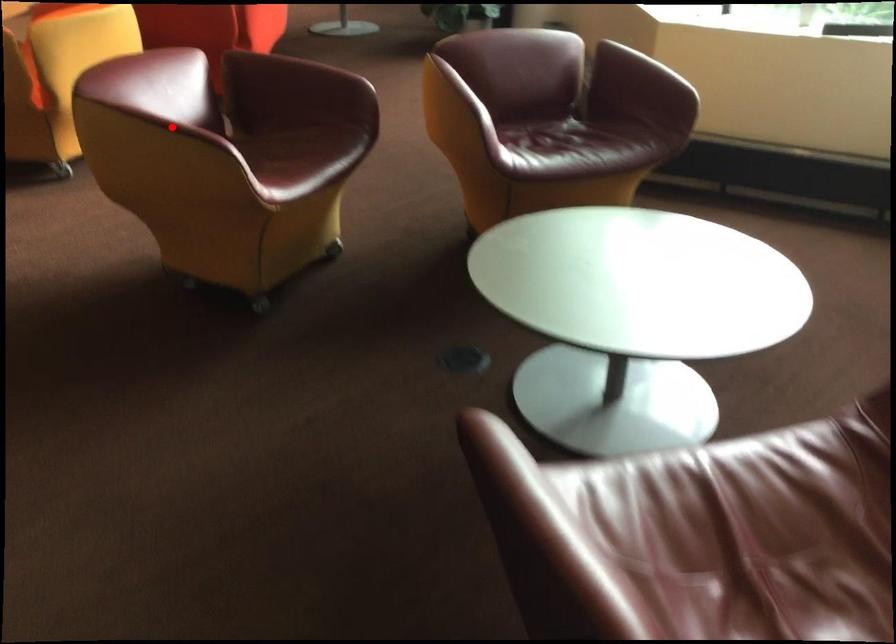
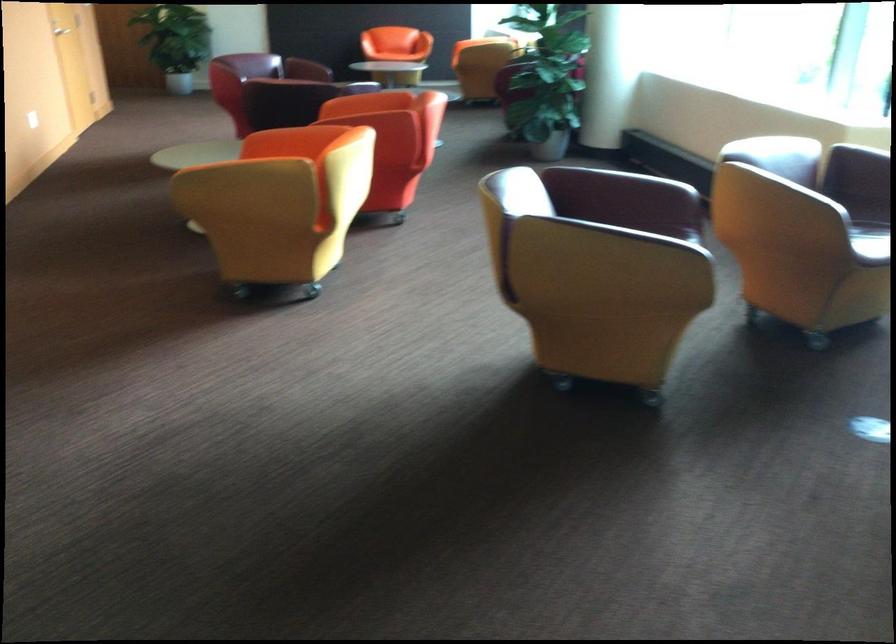
Question: I am providing you with two images of the same scene from different viewpoints. A red point is marked on the first image. Can you still see the location of the red point in image 2?

Choices:
 (A) Yes
 (B) No

Answer: (B)